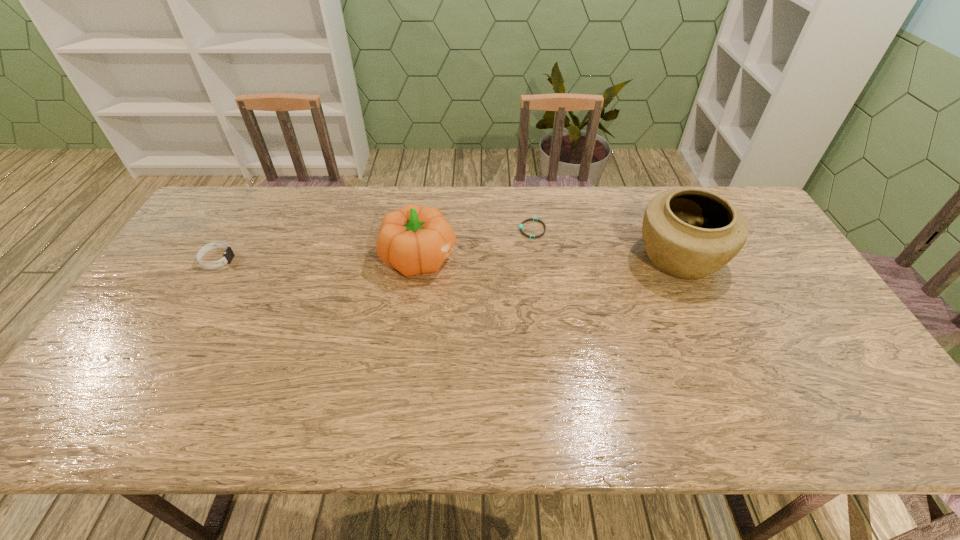
In the image, there is a desktop. At what (x,y) coordinates should I click in order to perform the action: click on free space at the near left corner. Please return your answer as a coordinate pair (x, y). The image size is (960, 540). Looking at the image, I should click on (115, 409).

Find the location of a particular element. vacant region between the rightmost object and the leftmost object is located at coordinates (448, 259).

Locate an element on the screen. vacant point located between the pumpkin and the rightmost object is located at coordinates (550, 258).

Image resolution: width=960 pixels, height=540 pixels. What are the coordinates of `empty location between the pumpkin and the taller wristband` in the screenshot? It's located at (319, 259).

The image size is (960, 540). In order to click on free space between the right wristband and the pottery in this screenshot , I will do `click(606, 244)`.

Identify the location of free spot between the rightmost object and the pumpkin. This screenshot has width=960, height=540. (550, 258).

I want to click on unoccupied area between the third object from right to left and the leftmost object, so click(319, 259).

You are a GUI agent. You are given a task and a screenshot of the screen. Output one action in this format:
    pyautogui.click(x=<x>, y=<y>)
    Task: Click on the vacant space that is in between the farther wristband and the rightmost object
    This screenshot has height=540, width=960.
    Given the screenshot: What is the action you would take?
    pyautogui.click(x=606, y=244)

Identify the location of free space between the third object from right to left and the pottery. Image resolution: width=960 pixels, height=540 pixels. (550, 258).

Locate an element on the screen. free space between the second object from left to right and the shorter wristband is located at coordinates (476, 244).